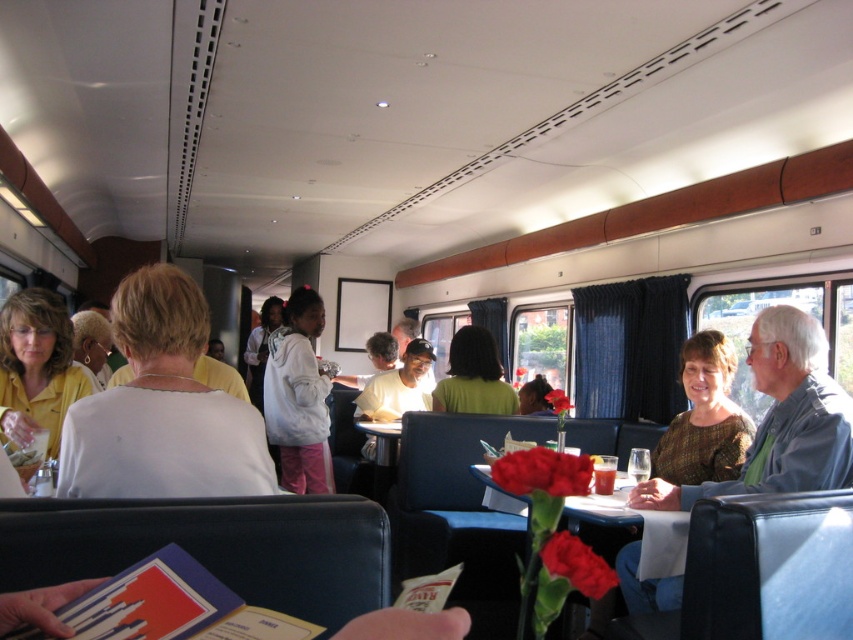
Is white matte shirt at center shorter than white fleece jacket at center?

Indeed, white matte shirt at center has a lesser height compared to white fleece jacket at center.

Is white matte shirt at center bigger than white fleece jacket at center?

Actually, white matte shirt at center might be smaller than white fleece jacket at center.

At what (x,y) coordinates should I click in order to perform the action: click on white matte shirt at center. Please return your answer as a coordinate pair (x, y). This screenshot has width=853, height=640. Looking at the image, I should click on (161, 408).

The image size is (853, 640). I want to click on white matte shirt at center, so click(161, 408).

Between matte black table at center and green matte shirt at center, which one is positioned higher?

green matte shirt at center

Does matte black table at center have a lesser width compared to green matte shirt at center?

No, matte black table at center is not thinner than green matte shirt at center.

Between point (775, 328) and point (456, 392), which one is positioned behind?

Positioned behind is point (456, 392).

The image size is (853, 640). I want to click on matte black table at center, so click(x=780, y=419).

Find the location of `white fleece jacket at center`. white fleece jacket at center is located at coordinates (299, 396).

Can you confirm if white fleece jacket at center is positioned to the right of green matte shirt at center?

No, white fleece jacket at center is not to the right of green matte shirt at center.

This screenshot has height=640, width=853. What do you see at coordinates (299, 396) in the screenshot? I see `white fleece jacket at center` at bounding box center [299, 396].

Locate an element on the screen. white fleece jacket at center is located at coordinates (299, 396).